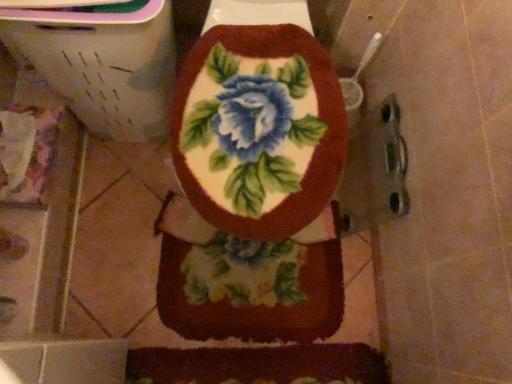
Image resolution: width=512 pixels, height=384 pixels. I want to click on floral fabric toilet seat at center, so click(x=255, y=187).

Describe the element at coordinates (255, 187) in the screenshot. This screenshot has height=384, width=512. I see `floral fabric toilet seat at center` at that location.

This screenshot has height=384, width=512. What are the coordinates of `fluffy floral rug at center` in the screenshot? It's located at (244, 283).

Describe the element at coordinates (244, 283) in the screenshot. Image resolution: width=512 pixels, height=384 pixels. I see `fluffy floral rug at center` at that location.

Where is `floral fabric toilet seat at center`? The width and height of the screenshot is (512, 384). floral fabric toilet seat at center is located at coordinates (255, 187).

Considering the relative positions of floral fabric toilet seat at center and fluffy floral rug at center in the image provided, is floral fabric toilet seat at center to the left or to the right of fluffy floral rug at center?

floral fabric toilet seat at center is positioned on fluffy floral rug at center's left side.

Based on the photo, between floral fabric toilet seat at center and fluffy floral rug at center, which one is positioned in front?

floral fabric toilet seat at center is more forward.

Is point (260, 144) closer or farther from the camera than point (186, 294)?

Clearly, point (260, 144) is closer to the camera than point (186, 294).

From the image's perspective, which one is positioned higher, floral fabric toilet seat at center or fluffy floral rug at center?

floral fabric toilet seat at center.

Consider the image. From a real-world perspective, is floral fabric toilet seat at center positioned over fluffy floral rug at center based on gravity?

Indeed, from a real-world perspective, floral fabric toilet seat at center stands above fluffy floral rug at center.

Looking at this image, considering the sizes of floral fabric toilet seat at center and fluffy floral rug at center in the image, is floral fabric toilet seat at center wider or thinner than fluffy floral rug at center?

In the image, floral fabric toilet seat at center appears to be wider than fluffy floral rug at center.

Who is taller, floral fabric toilet seat at center or fluffy floral rug at center?

With more height is fluffy floral rug at center.

In terms of size, does floral fabric toilet seat at center appear bigger or smaller than fluffy floral rug at center?

floral fabric toilet seat at center is bigger than fluffy floral rug at center.

Is floral fabric toilet seat at center surrounding fluffy floral rug at center?

Yes, fluffy floral rug at center can be found within floral fabric toilet seat at center.

Are floral fabric toilet seat at center and fluffy floral rug at center beside each other?

Indeed, floral fabric toilet seat at center and fluffy floral rug at center are beside each other and touching.

Is floral fabric toilet seat at center facing away from fluffy floral rug at center?

That's right, floral fabric toilet seat at center is facing away from fluffy floral rug at center.

How much distance is there between floral fabric toilet seat at center and fluffy floral rug at center?

They are 0.29 inches apart.

Identify the location of blanket behind the floral fabric toilet seat at center. (244, 283).

Considering the relative positions of fluffy floral rug at center and floral fabric toilet seat at center in the image provided, is fluffy floral rug at center to the left or to the right of floral fabric toilet seat at center?

In the image, fluffy floral rug at center appears on the right side of floral fabric toilet seat at center.

Relative to floral fabric toilet seat at center, is fluffy floral rug at center in front or behind?

fluffy floral rug at center is behind floral fabric toilet seat at center.

Between point (241, 300) and point (217, 162), which one is positioned in front?

The point (217, 162) is closer to the camera.

From the image's perspective, which one is positioned lower, fluffy floral rug at center or floral fabric toilet seat at center?

From the image's view, fluffy floral rug at center is below.

From a real-world perspective, which object stands above the other?

From a 3D spatial view, floral fabric toilet seat at center is above.

Is fluffy floral rug at center thinner than floral fabric toilet seat at center?

Indeed, fluffy floral rug at center has a lesser width compared to floral fabric toilet seat at center.

Who is shorter, fluffy floral rug at center or floral fabric toilet seat at center?

Result: Standing shorter between the two is floral fabric toilet seat at center.

Can you confirm if fluffy floral rug at center is smaller than floral fabric toilet seat at center?

Yes, fluffy floral rug at center is smaller than floral fabric toilet seat at center.

Is floral fabric toilet seat at center completely or partially inside fluffy floral rug at center?

Definitely not — floral fabric toilet seat at center is not inside fluffy floral rug at center.

Is fluffy floral rug at center placed right next to floral fabric toilet seat at center?

Yes, fluffy floral rug at center is beside floral fabric toilet seat at center.

Based on the photo, is floral fabric toilet seat at center at the back of fluffy floral rug at center?

Absolutely, fluffy floral rug at center is directed away from floral fabric toilet seat at center.

Can you tell me how much fluffy floral rug at center and floral fabric toilet seat at center differ in facing direction?

fluffy floral rug at center and floral fabric toilet seat at center are facing 0.000155 degrees away from each other.

How much distance is there between fluffy floral rug at center and floral fabric toilet seat at center?

A distance of 0.29 inches exists between fluffy floral rug at center and floral fabric toilet seat at center.

Image resolution: width=512 pixels, height=384 pixels. I want to click on toilet in front of the fluffy floral rug at center, so click(x=255, y=187).

Identify the location of toilet located in front of the fluffy floral rug at center. (255, 187).

Where is `toilet on the left of fluffy floral rug at center`? The width and height of the screenshot is (512, 384). toilet on the left of fluffy floral rug at center is located at coordinates (255, 187).